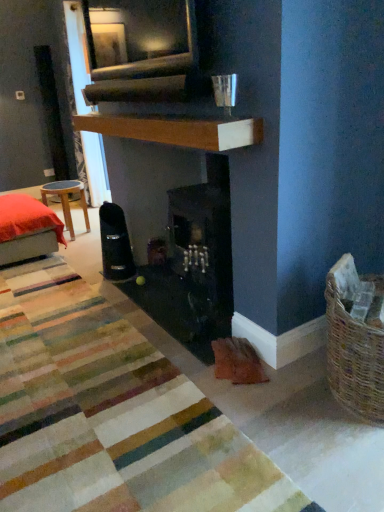
Question: Considering the relative positions of white textured curtain at upper left and striped wool rug at center in the image provided, is white textured curtain at upper left to the left or to the right of striped wool rug at center?

Choices:
 (A) right
 (B) left

Answer: (B)

Question: From the image's perspective, is white textured curtain at upper left above or below striped wool rug at center?

Choices:
 (A) below
 (B) above

Answer: (B)

Question: Which is nearer to the white textured curtain at upper left?

Choices:
 (A) wooden stool at left
 (B) wooden mantle at upper center
 (C) velvet red cushion at left
 (D) striped wool rug at center

Answer: (A)

Question: Which object is positioned farthest from the wooden stool at left?

Choices:
 (A) white textured curtain at upper left
 (B) wooden mantle at upper center
 (C) velvet red cushion at left
 (D) striped wool rug at center

Answer: (D)